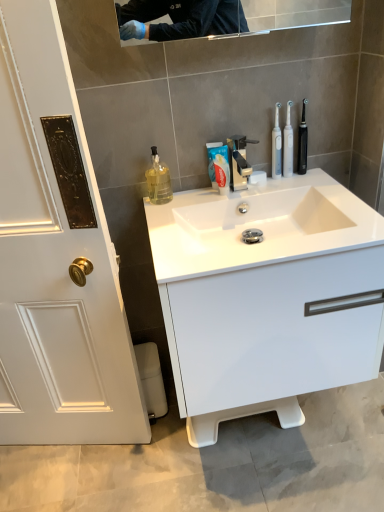
At what (x,y) coordinates should I click in order to perform the action: click on unoccupied area in front of translucent glass mouthwash at left, the 1th mouthwash positioned from the left. Please return your answer as a coordinate pair (x, y). This screenshot has height=512, width=384. Looking at the image, I should click on (161, 216).